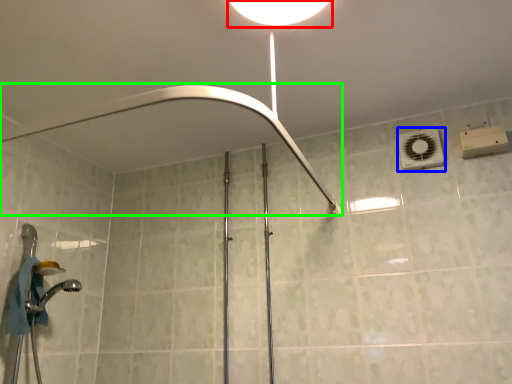
Question: Which object is the closest to the light fixture (highlighted by a red box)? Choose among these: air conditioner (highlighted by a blue box) or shower (highlighted by a green box).

Choices:
 (A) air conditioner
 (B) shower

Answer: (B)